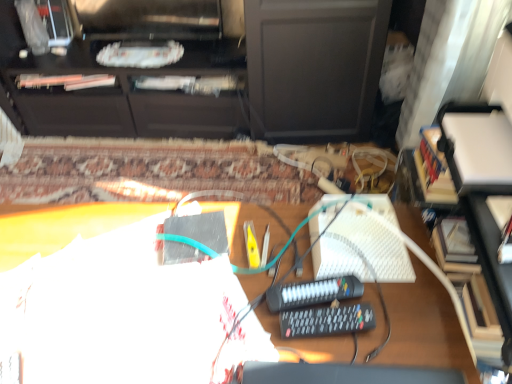
Identify the location of vacant area that lies to the right of black plastic remote control at center, which appears as the second equipment when viewed from the front. (x=410, y=310).